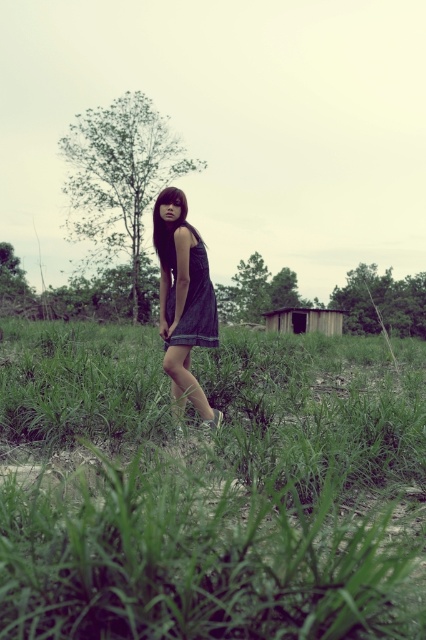
Question: Observing the image, what is the correct spatial positioning of green grassy at center in reference to satin dress at center?

Choices:
 (A) right
 (B) left

Answer: (A)

Question: Is green grassy at center positioned in front of denim dress at center?

Choices:
 (A) yes
 (B) no

Answer: (A)

Question: Where is green grassy at center located in relation to wooden hut at center in the image?

Choices:
 (A) right
 (B) left

Answer: (B)

Question: Among these points, which one is nearest to the camera?

Choices:
 (A) (181, 204)
 (B) (178, 332)
 (C) (11, 611)

Answer: (C)

Question: Estimate the real-world distances between objects in this image. Which object is closer to the green grassy at center?

Choices:
 (A) wooden hut at center
 (B) denim dress at center
 (C) satin dress at center

Answer: (B)

Question: Which object appears closest to the camera in this image?

Choices:
 (A) denim dress at center
 (B) green grassy at center

Answer: (B)